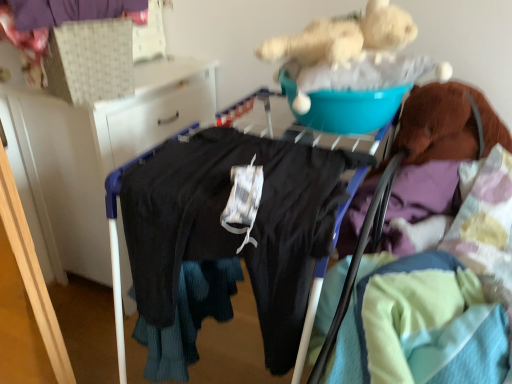
Question: Is black fabric at left at the back of black matte pants at center, the 2th clothing when ordered from top to bottom?

Choices:
 (A) yes
 (B) no

Answer: (A)

Question: Considering the relative positions of black matte pants at center, the first clothing positioned from the bottom, and black fabric at left in the image provided, is black matte pants at center, the first clothing positioned from the bottom, to the right of black fabric at left from the viewer's perspective?

Choices:
 (A) no
 (B) yes

Answer: (B)

Question: Does black matte pants at center, which appears as the 1th clothing when viewed from the right, lie in front of black fabric at left?

Choices:
 (A) no
 (B) yes

Answer: (B)

Question: Is black matte pants at center, placed as the second clothing when sorted from left to right, wider than black fabric at left?

Choices:
 (A) yes
 (B) no

Answer: (A)

Question: Is black matte pants at center, the 2th clothing when ordered from top to bottom, to the left of black fabric at left from the viewer's perspective?

Choices:
 (A) no
 (B) yes

Answer: (A)

Question: Is black matte pants at center, the first clothing positioned from the bottom, to the left or to the right of black fabric at left in the image?

Choices:
 (A) left
 (B) right

Answer: (B)

Question: Is black matte pants at center, which appears as the 1th clothing when viewed from the right, taller or shorter than black fabric at left?

Choices:
 (A) short
 (B) tall

Answer: (A)

Question: Based on their sizes in the image, would you say black matte pants at center, placed as the second clothing when sorted from left to right, is bigger or smaller than black fabric at left?

Choices:
 (A) big
 (B) small

Answer: (A)

Question: Is point (264, 157) positioned closer to the camera than point (24, 147)?

Choices:
 (A) closer
 (B) farther

Answer: (A)

Question: Considering the positions of point (32, 178) and point (22, 0), is point (32, 178) closer or farther from the camera than point (22, 0)?

Choices:
 (A) farther
 (B) closer

Answer: (A)

Question: From a real-world perspective, relative to purple fabric at upper left, which is counted as the 2th clothing, starting from the bottom, is black fabric at left vertically above or below?

Choices:
 (A) below
 (B) above

Answer: (A)

Question: Based on their sizes in the image, would you say black fabric at left is bigger or smaller than purple fabric at upper left, the first clothing from the top?

Choices:
 (A) small
 (B) big

Answer: (B)

Question: Considering the positions of black fabric at left and purple fabric at upper left, the first clothing from the top, in the image, is black fabric at left taller or shorter than purple fabric at upper left, the first clothing from the top,?

Choices:
 (A) short
 (B) tall

Answer: (B)

Question: From the image's perspective, is purple fabric at upper left, the first clothing from the top, positioned above or below black fabric at left?

Choices:
 (A) below
 (B) above

Answer: (B)

Question: Is purple fabric at upper left, the first clothing from the top, in front of or behind black fabric at left in the image?

Choices:
 (A) behind
 (B) front

Answer: (B)